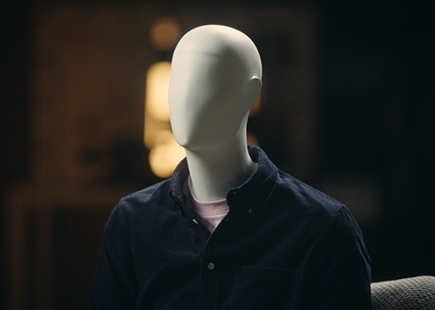
The width and height of the screenshot is (435, 310). Identify the location of light. (154, 86).